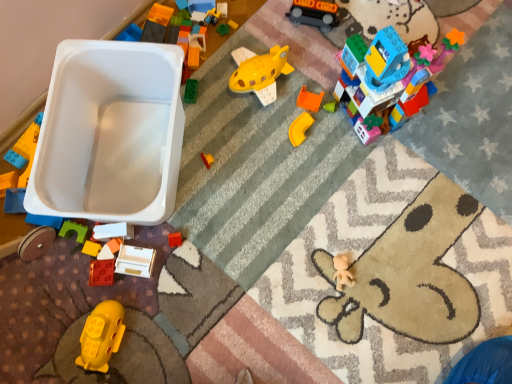
Locate an element on the screen. empty space that is in between yellow matte plastic corner piece at center-right, acting as the third toy starting from the right, and yellow matte toy submarine at lower left, which is counted as the eighth toy, starting from the top is located at coordinates (203, 237).